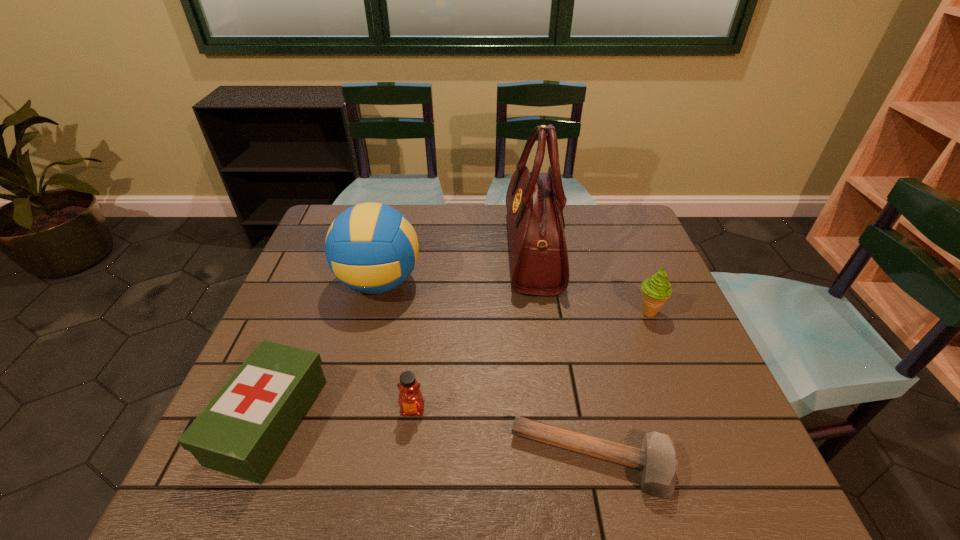
This screenshot has width=960, height=540. Identify the location of free location located on the back of the second tallest object. (x=397, y=214).

Identify the location of vacant space located 0.200m on the back of the third tallest object. Image resolution: width=960 pixels, height=540 pixels. (626, 255).

Image resolution: width=960 pixels, height=540 pixels. Find the location of `free space located on the front label of the honey`. free space located on the front label of the honey is located at coordinates (405, 468).

The image size is (960, 540). In order to click on vacant point located 0.050m on the right of the first-aid kit in this screenshot , I will do `click(341, 421)`.

This screenshot has height=540, width=960. In order to click on free space located on the left of the shortest object in this screenshot , I will do `click(325, 460)`.

You are a GUI agent. You are given a task and a screenshot of the screen. Output one action in this format:
    pyautogui.click(x=<x>, y=<y>)
    Task: Click on the object at the far edge
    The image size is (960, 540).
    Given the screenshot: What is the action you would take?
    pyautogui.click(x=539, y=259)

Image resolution: width=960 pixels, height=540 pixels. Find the location of `the first-aid kit present at the near edge`. the first-aid kit present at the near edge is located at coordinates (242, 431).

The image size is (960, 540). In order to click on mallet located at the near edge in this screenshot , I will do `click(657, 461)`.

At what (x,y) coordinates should I click in order to perform the action: click on volleyball that is positioned at the left edge. Please return your answer as a coordinate pair (x, y). The width and height of the screenshot is (960, 540). Looking at the image, I should click on (372, 248).

Find the location of a particular element. Image resolution: width=960 pixels, height=540 pixels. the first-aid kit that is at the left edge is located at coordinates (242, 431).